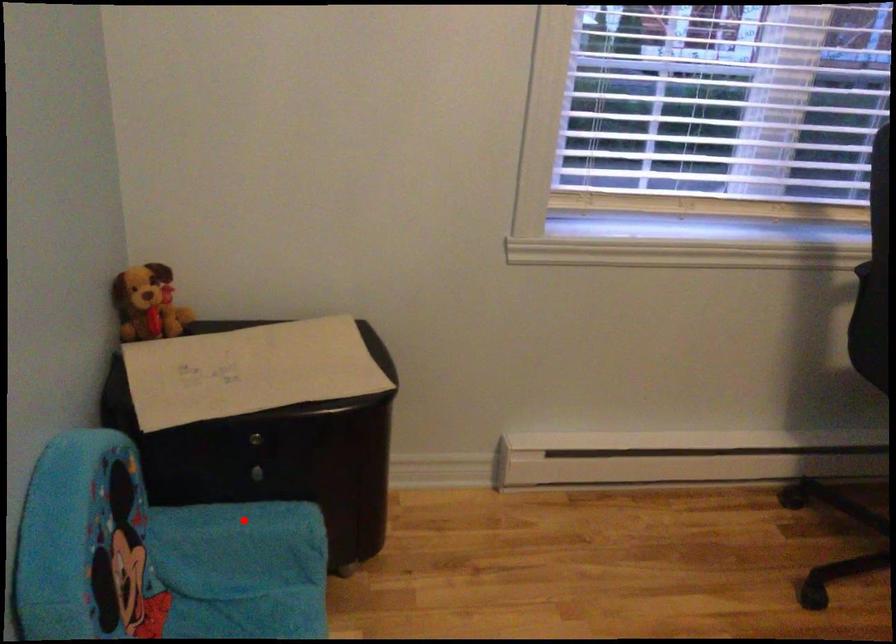
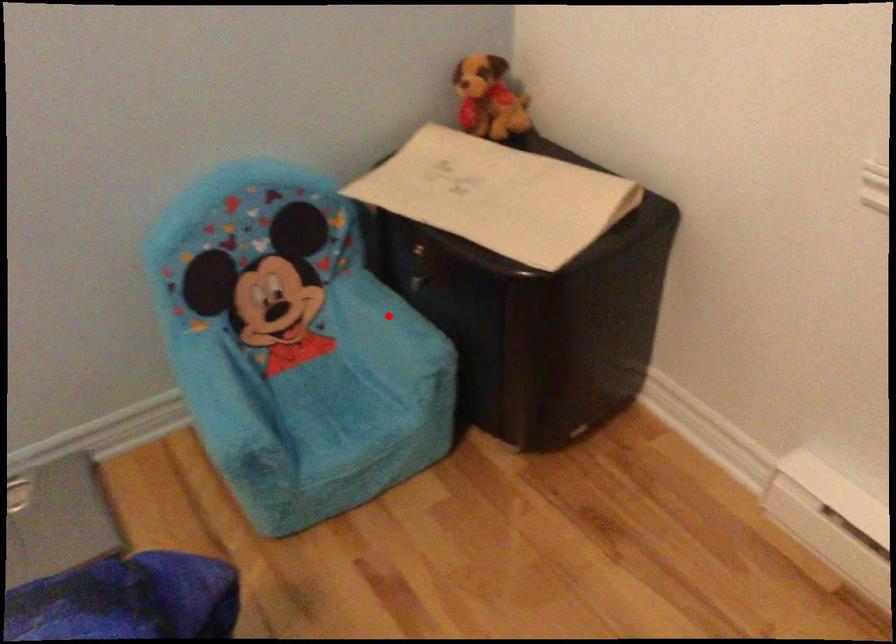
I am providing you with two images of the same scene from different viewpoints. A red point is marked on the first image and another point is marked on the second image. Does the point marked in image1 correspond to the same location as the one in image2?

Yes